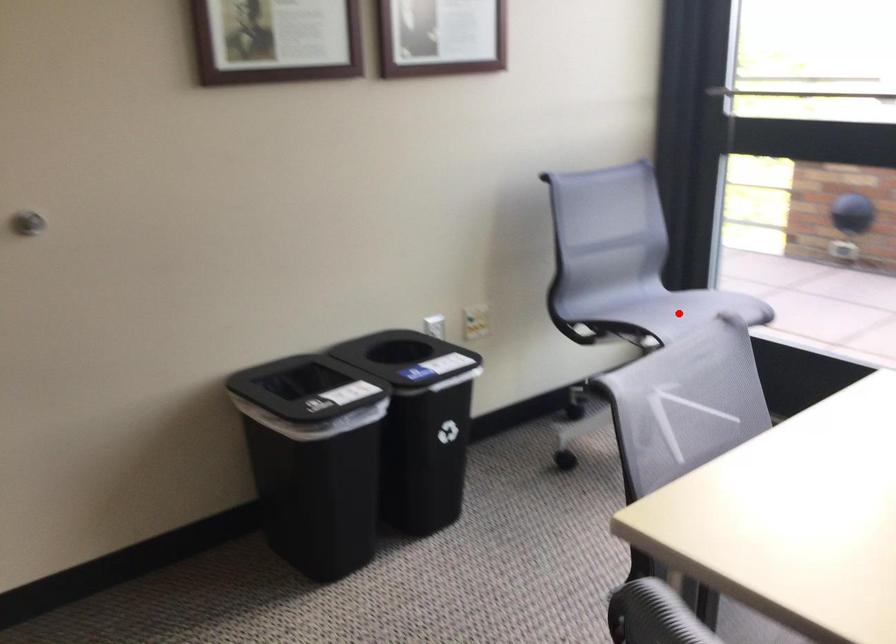
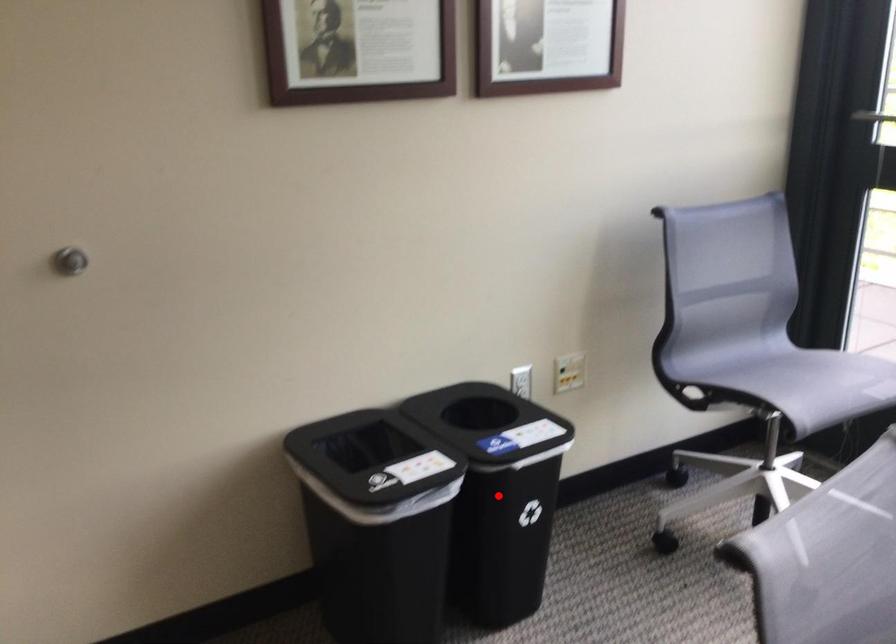
I am providing you with two images of the same scene from different viewpoints. A red point is marked on the first image and another point is marked on the second image. Does the point marked in image1 correspond to the same location as the one in image2?

No